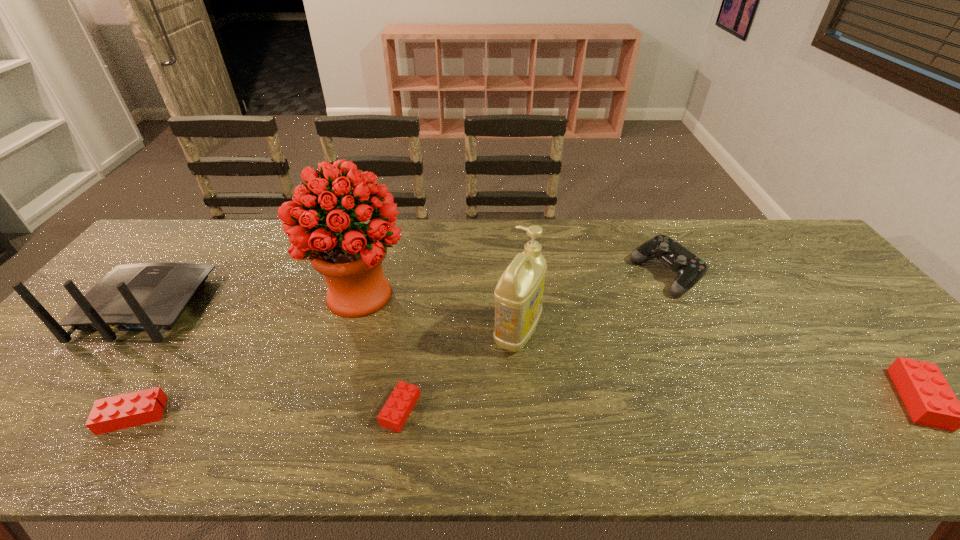
Find the location of a particular element. The width and height of the screenshot is (960, 540). the second shortest object is located at coordinates (128, 410).

Identify the location of the second tallest Lego. (128, 410).

Identify the location of the shortest Lego. (394, 414).

Identify the location of the shortest object. The height and width of the screenshot is (540, 960). (394, 414).

This screenshot has width=960, height=540. Identify the location of the fifth object from left to right. point(518,295).

Identify the location of the second tallest object. The image size is (960, 540). (518, 295).

This screenshot has width=960, height=540. Identify the location of router. (151, 297).

Where is `the fourth shortest object`? This screenshot has height=540, width=960. the fourth shortest object is located at coordinates (689, 268).

You are a GUI agent. You are given a task and a screenshot of the screen. Output one action in this format:
    pyautogui.click(x=<x>, y=<y>)
    Task: Click on the control
    The height and width of the screenshot is (540, 960).
    Given the screenshot: What is the action you would take?
    pyautogui.click(x=689, y=268)

In order to click on the tallest object in this screenshot , I will do `click(325, 228)`.